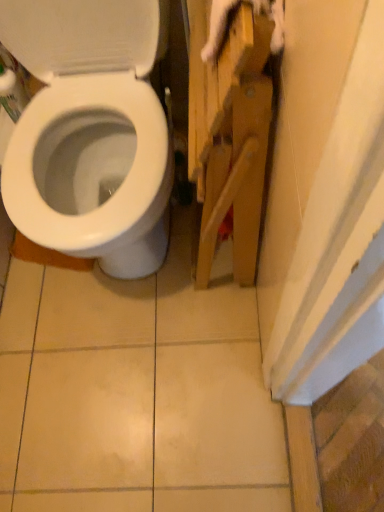
Question: Is wooden cabinet at right at the right side of white glossy toilet at left?

Choices:
 (A) no
 (B) yes

Answer: (B)

Question: Is wooden cabinet at right thinner than white glossy toilet at left?

Choices:
 (A) no
 (B) yes

Answer: (B)

Question: Are wooden cabinet at right and white glossy toilet at left far apart?

Choices:
 (A) yes
 (B) no

Answer: (B)

Question: From the image's perspective, is wooden cabinet at right above white glossy toilet at left?

Choices:
 (A) yes
 (B) no

Answer: (B)

Question: Considering the relative sizes of wooden cabinet at right and white glossy toilet at left in the image provided, is wooden cabinet at right shorter than white glossy toilet at left?

Choices:
 (A) yes
 (B) no

Answer: (A)

Question: Considering the relative sizes of wooden cabinet at right and white glossy toilet at left in the image provided, is wooden cabinet at right bigger than white glossy toilet at left?

Choices:
 (A) yes
 (B) no

Answer: (B)

Question: Is white glossy toilet at left taller than wooden cabinet at right?

Choices:
 (A) yes
 (B) no

Answer: (A)

Question: Is wooden cabinet at right inside white glossy toilet at left?

Choices:
 (A) yes
 (B) no

Answer: (B)

Question: Is white glossy toilet at left not close to wooden cabinet at right?

Choices:
 (A) no
 (B) yes

Answer: (A)

Question: Is white glossy toilet at left shorter than wooden cabinet at right?

Choices:
 (A) no
 (B) yes

Answer: (A)

Question: Is white glossy toilet at left positioned in front of wooden cabinet at right?

Choices:
 (A) no
 (B) yes

Answer: (B)

Question: Is white glossy toilet at left positioned with its back to wooden cabinet at right?

Choices:
 (A) yes
 (B) no

Answer: (B)

Question: From a real-world perspective, is wooden cabinet at right physically located above or below white glossy toilet at left?

Choices:
 (A) below
 (B) above

Answer: (A)